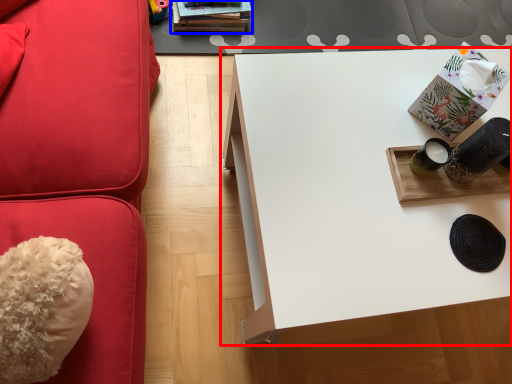
Question: Which point is further to the camera, table (highlighted by a red box) or book (highlighted by a blue box)?

Choices:
 (A) table
 (B) book

Answer: (B)